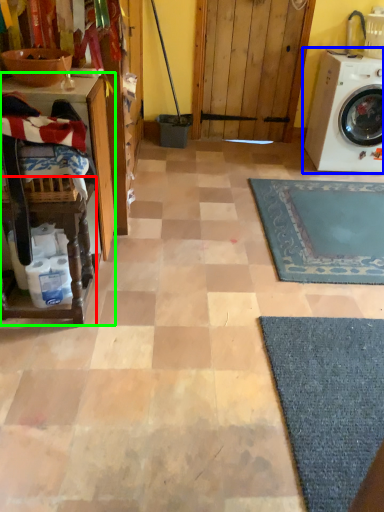
Question: Which object is the farthest from table (highlighted by a red box)? Choose among these: washing machine (highlighted by a blue box) or table (highlighted by a green box).

Choices:
 (A) washing machine
 (B) table

Answer: (A)